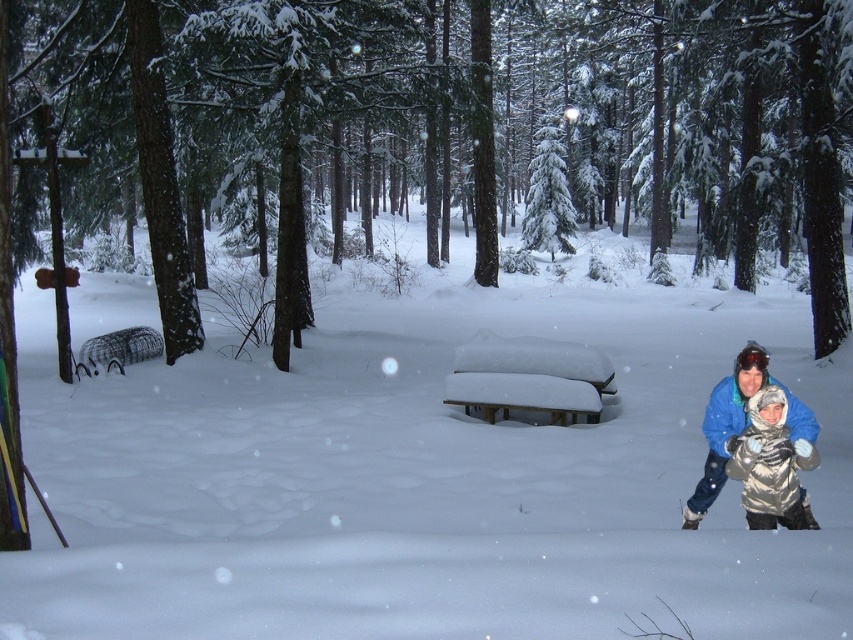
Is white fluffy snow at center shorter than snow-covered wood picnic table at center?

No, white fluffy snow at center is not shorter than snow-covered wood picnic table at center.

Between white fluffy snow at center and snow-covered wood picnic table at center, which one has more height?

white fluffy snow at center is taller.

Locate an element on the screen. white fluffy snow at center is located at coordinates (422, 480).

Is brown textured log at center positioned behind snow-covered wood picnic table at center?

Yes, brown textured log at center is further from the viewer.

The width and height of the screenshot is (853, 640). What are the coordinates of `brown textured log at center` in the screenshot? It's located at (553, 106).

Is point (619, 288) farther from viewer compared to point (741, 500)?

Yes, it is behind point (741, 500).

Who is more distant from viewer, (675, 324) or (787, 512)?

Positioned behind is point (675, 324).

Find the location of a particular element. This screenshot has height=640, width=853. white fluffy snow at center is located at coordinates (422, 480).